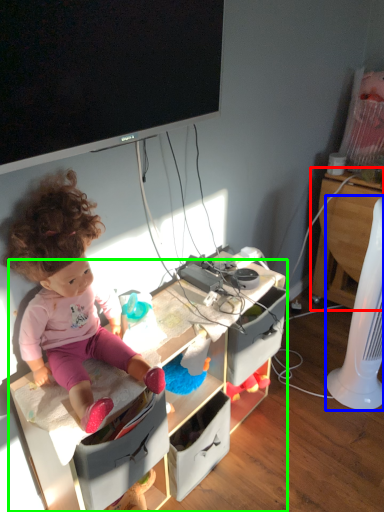
Question: Which object is positioned closest to computer desk (highlighted by a red box)? Select from fan (highlighted by a blue box) and desk (highlighted by a green box).

Choices:
 (A) fan
 (B) desk

Answer: (A)